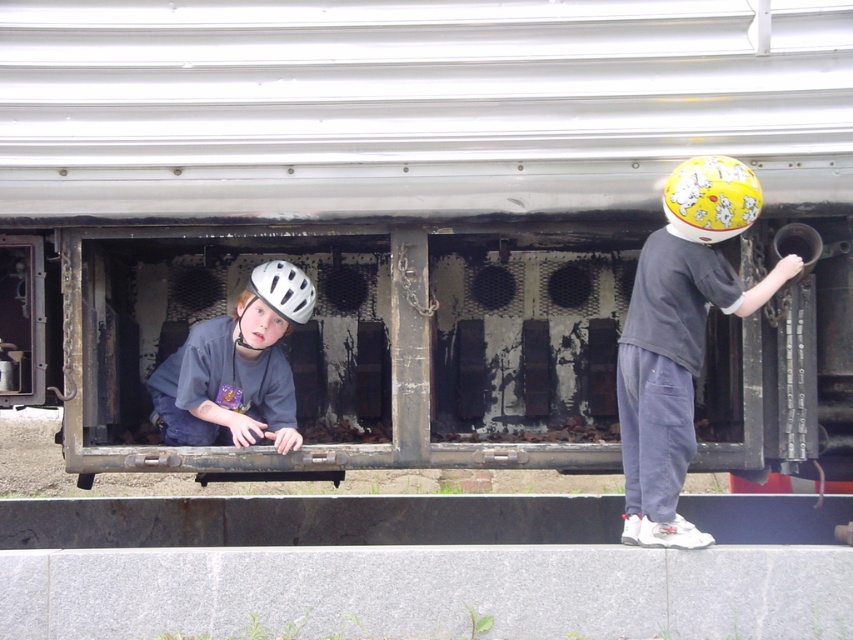
You are a safety inspector checking the train car. The yellow matte helmet at upper right is required to be placed at a specific safety zone. According to the coordinates provided, is the helmet positioned correctly if the safety zone is defined as the area between points 0.2 and 0.4 on the x and y axes?

The yellow matte helmet at upper right is located at point (711, 198). The safety zone requires coordinates between 0.2 and 0.4 on both axes. Since the y coordinate 0.834 exceeds 0.4, the helmet is not positioned correctly within the safety zone.

You are a safety inspector checking the helmets of two children playing near the train car. Which helmet, the yellow matte helmet at right or the matte gray helmet at left, has a greater height measurement?

The yellow matte helmet at right is taller than the matte gray helmet at left.